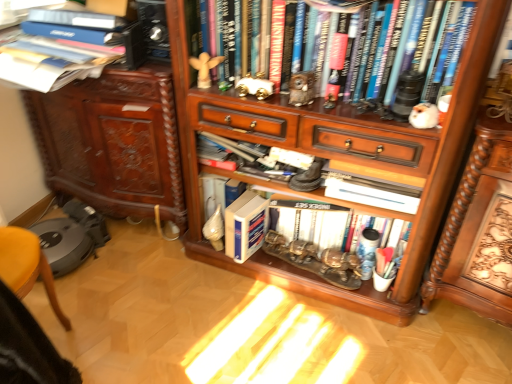
I want to click on vacant space in front of wooden bookcase at center, so click(303, 343).